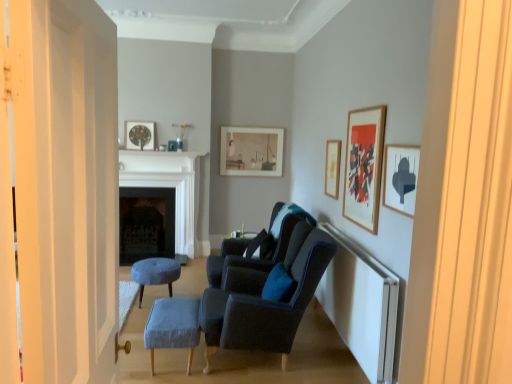
Image resolution: width=512 pixels, height=384 pixels. I want to click on vacant area on top of blue fabric stool at lower center, which ranks as the 1th stool in right-to-left order (from a real-world perspective), so click(175, 311).